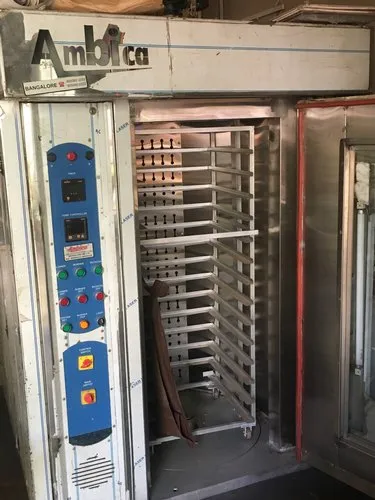
This screenshot has width=375, height=500. What are the coordinates of `green lights` in the screenshot? It's located at (61, 274), (81, 272), (98, 270), (67, 328).